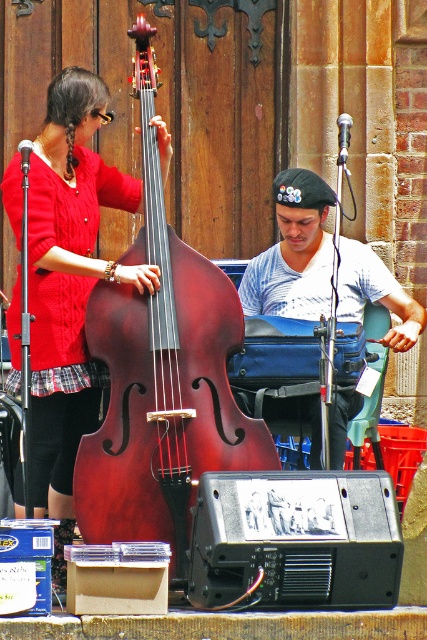
You are a fashion designer observing the musician in the scene. You notice the matte red sweater at center and the striped cotton shirt at center. Which clothing item is worn on top?

The matte red sweater at center is positioned over the striped cotton shirt at center, so the matte red sweater at center is worn on top.

Looking at this image, you are a photographer setting up for a shoot and need to ensure that both the shiny dark wood cello at center and the matte red sweater at center are in focus. Which object should you focus on first if you want to adjust the camera settings for the larger object?

The shiny dark wood cello at center is bigger than the matte red sweater at center, so you should focus on the shiny dark wood cello at center first to adjust the camera settings for the larger object.

You are a photographer trying to capture the shiny dark wood cello at center and the matte red sweater at center in a single shot. Which object will appear taller in the photo?

The shiny dark wood cello at center will appear taller in the photo since it has a greater height compared to the matte red sweater at center.